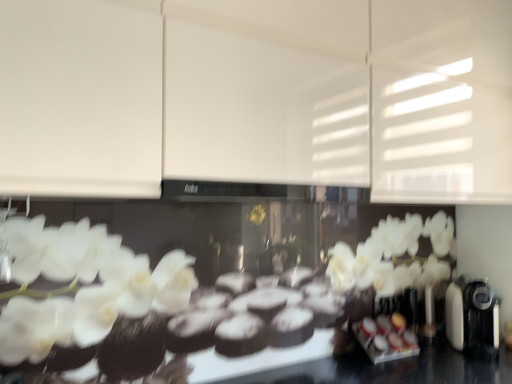
Question: Considering the positions of black plastic coffee machine at right and white glossy canisters at center in the image, is black plastic coffee machine at right taller or shorter than white glossy canisters at center?

Choices:
 (A) tall
 (B) short

Answer: (A)

Question: Does point (453, 344) appear closer or farther from the camera than point (401, 332)?

Choices:
 (A) farther
 (B) closer

Answer: (A)

Question: Considering the real-world distances, which object is farthest from the white glossy canisters at center?

Choices:
 (A) white matte cabinet at upper center
 (B) black plastic coffee machine at right

Answer: (A)

Question: Based on their relative distances, which object is farther from the white matte cabinet at upper center?

Choices:
 (A) black plastic coffee machine at right
 (B) white glossy canisters at center

Answer: (B)